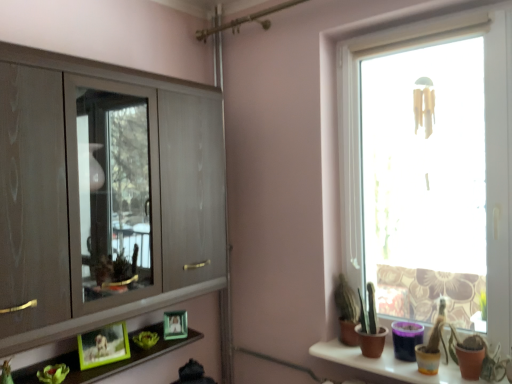
The width and height of the screenshot is (512, 384). Describe the element at coordinates (388, 364) in the screenshot. I see `terracotta clay pots at lower right` at that location.

Where is `matte wood cupboard at left`? This screenshot has height=384, width=512. matte wood cupboard at left is located at coordinates (103, 194).

What is the approximate width of green matte picture frame at lower center, the second picture frame from the left?

It is 2.56 inches.

The height and width of the screenshot is (384, 512). What do you see at coordinates (103, 346) in the screenshot? I see `green matte picture frame at lower left, which appears as the 1th picture frame when viewed from the front` at bounding box center [103, 346].

This screenshot has height=384, width=512. In order to click on terracotta clay pots at lower right in this screenshot , I will do `click(388, 364)`.

Which point is more distant from viewer, (352, 116) or (169, 315)?

The point (169, 315) is behind.

From the image's perspective, which one is positioned lower, transparent glass window at right or green matte picture frame at lower center, placed as the second picture frame when sorted from front to back?

green matte picture frame at lower center, placed as the second picture frame when sorted from front to back.

Considering the relative sizes of transparent glass window at right and green matte picture frame at lower center, placed as the second picture frame when sorted from front to back, in the image provided, is transparent glass window at right thinner than green matte picture frame at lower center, placed as the second picture frame when sorted from front to back,?

In fact, transparent glass window at right might be wider than green matte picture frame at lower center, placed as the second picture frame when sorted from front to back.

Where is `the 2nd picture frame below the transparent glass window at right (from the image's perspective)`? The image size is (512, 384). the 2nd picture frame below the transparent glass window at right (from the image's perspective) is located at coordinates (175, 325).

Can you confirm if terracotta clay pots at lower right is smaller than green matte plant at lower left?

Actually, terracotta clay pots at lower right might be larger than green matte plant at lower left.

From the image's perspective, is terracotta clay pots at lower right located above green matte plant at lower left?

Actually, terracotta clay pots at lower right appears below green matte plant at lower left in the image.

Is green matte plant at lower left surrounded by terracotta clay pots at lower right?

No, green matte plant at lower left is not a part of terracotta clay pots at lower right.

I want to click on plant located above the terracotta clay pots at lower right (from a real-world perspective), so click(53, 374).

Would you say transparent glass window at right contains matte wood cupboard at left?

No.

How different are the orientations of transparent glass window at right and matte wood cupboard at left in degrees?

The facing directions of transparent glass window at right and matte wood cupboard at left are 90.2 degrees apart.

From a real-world perspective, is transparent glass window at right on matte wood cupboard at left?

No, from a real-world perspective, transparent glass window at right is not on top of matte wood cupboard at left.

Considering the sizes of objects terracotta clay pots at lower right and green matte picture frame at lower center, which is the first picture frame in back-to-front order, in the image provided, who is thinner, terracotta clay pots at lower right or green matte picture frame at lower center, which is the first picture frame in back-to-front order,?

green matte picture frame at lower center, which is the first picture frame in back-to-front order, is thinner.

Relative to green matte picture frame at lower center, placed as the second picture frame when sorted from front to back, is terracotta clay pots at lower right in front or behind?

Clearly, terracotta clay pots at lower right is in front of green matte picture frame at lower center, placed as the second picture frame when sorted from front to back.

Is terracotta clay pots at lower right turned away from green matte picture frame at lower center, which is the first picture frame in back-to-front order?

No, green matte picture frame at lower center, which is the first picture frame in back-to-front order, is not at the back of terracotta clay pots at lower right.

Does terracotta clay pots at lower right touch green matte picture frame at lower center, the 1th picture frame positioned from the right?

No, terracotta clay pots at lower right is not next to green matte picture frame at lower center, the 1th picture frame positioned from the right.

From the image's perspective, is matte wood cupboard at left located beneath green matte picture frame at lower center, placed as the second picture frame when sorted from front to back?

No, from the image's perspective, matte wood cupboard at left is not beneath green matte picture frame at lower center, placed as the second picture frame when sorted from front to back.

Between matte wood cupboard at left and green matte picture frame at lower center, placed as the second picture frame when sorted from front to back, which one is positioned behind?

green matte picture frame at lower center, placed as the second picture frame when sorted from front to back, is more distant.

Do you think matte wood cupboard at left is within green matte picture frame at lower center, the second picture frame from the left, or outside of it?

matte wood cupboard at left exists outside the volume of green matte picture frame at lower center, the second picture frame from the left.

Would you consider matte wood cupboard at left to be distant from green matte picture frame at lower center, the 1th picture frame positioned from the right?

No, matte wood cupboard at left is not far from green matte picture frame at lower center, the 1th picture frame positioned from the right.

How much distance is there between green matte plant at lower left and green matte picture frame at lower center, the second picture frame from the left?

green matte plant at lower left is 53.84 centimeters from green matte picture frame at lower center, the second picture frame from the left.

Can you confirm if green matte plant at lower left is taller than green matte picture frame at lower center, the second picture frame from the left?

In fact, green matte plant at lower left may be shorter than green matte picture frame at lower center, the second picture frame from the left.

Is green matte plant at lower left facing towards green matte picture frame at lower center, which is the first picture frame in back-to-front order?

No, green matte plant at lower left is not facing towards green matte picture frame at lower center, which is the first picture frame in back-to-front order.

Can you confirm if green matte plant at lower left is thinner than green matte picture frame at lower center, placed as the second picture frame when sorted from front to back?

No.

Can you confirm if green matte picture frame at lower left, the 2th picture frame positioned from the right, is thinner than terracotta clay pots at lower right?

Yes, green matte picture frame at lower left, the 2th picture frame positioned from the right, is thinner than terracotta clay pots at lower right.

Considering the sizes of objects green matte picture frame at lower left, which appears as the 1th picture frame when viewed from the front, and terracotta clay pots at lower right in the image provided, who is shorter, green matte picture frame at lower left, which appears as the 1th picture frame when viewed from the front, or terracotta clay pots at lower right?

With less height is terracotta clay pots at lower right.

Consider the image. From the image's perspective, is green matte picture frame at lower left, the 2th picture frame positioned from the right, under terracotta clay pots at lower right?

Incorrect, from the image's perspective, green matte picture frame at lower left, the 2th picture frame positioned from the right, is higher than terracotta clay pots at lower right.

Would you say green matte picture frame at lower left, the second picture frame positioned from the back, contains terracotta clay pots at lower right?

Definitely not — terracotta clay pots at lower right is not inside green matte picture frame at lower left, the second picture frame positioned from the back.

Where is `the 2nd picture frame below when counting from the transparent glass window at right (from the image's perspective)`? The height and width of the screenshot is (384, 512). the 2nd picture frame below when counting from the transparent glass window at right (from the image's perspective) is located at coordinates (175, 325).

Find the location of a particular element. The image size is (512, 384). shelf that appears on the right of green matte plant at lower left is located at coordinates (388, 364).

From the picture: Which object lies further to the anchor point matte wood cupboard at left, terracotta clay pots at lower right or green matte plant at lower left?

terracotta clay pots at lower right is positioned further to the anchor matte wood cupboard at left.

Based on the photo, based on their spatial positions, is matte wood cupboard at left or green matte plant at lower left closer to transparent glass window at right?

Among the two, matte wood cupboard at left is located nearer to transparent glass window at right.

Considering their positions, is green matte picture frame at lower center, the 1th picture frame positioned from the right, positioned closer to green matte picture frame at lower left, the second picture frame positioned from the back, than matte wood cupboard at left?

Among the two, green matte picture frame at lower center, the 1th picture frame positioned from the right, is located nearer to green matte picture frame at lower left, the second picture frame positioned from the back.

Which object lies further to the anchor point terracotta clay pots at lower right, matte wood cupboard at left or transparent glass window at right?

Among the two, matte wood cupboard at left is located further to terracotta clay pots at lower right.

Considering their positions, is terracotta clay pots at lower right positioned further to green matte picture frame at lower left, the 2th picture frame positioned from the right, than matte wood cupboard at left?

The object further to green matte picture frame at lower left, the 2th picture frame positioned from the right, is terracotta clay pots at lower right.

Estimate the real-world distances between objects in this image. Which object is further from matte wood cupboard at left, terracotta clay pots at lower right or green matte picture frame at lower left, which is counted as the 1th picture frame, starting from the left?

The object further to matte wood cupboard at left is terracotta clay pots at lower right.

Estimate the real-world distances between objects in this image. Which object is closer to green matte picture frame at lower left, which is counted as the 1th picture frame, starting from the left, green matte picture frame at lower center, the second picture frame from the left, or green matte plant at lower left?

green matte plant at lower left is positioned closer to the anchor green matte picture frame at lower left, which is counted as the 1th picture frame, starting from the left.

When comparing their distances from green matte plant at lower left, does green matte picture frame at lower center, the second picture frame from the left, or transparent glass window at right seem further?

transparent glass window at right lies further to green matte plant at lower left than the other object.

Where is `cupboard between green matte plant at lower left and terracotta clay pots at lower right from left to right`? cupboard between green matte plant at lower left and terracotta clay pots at lower right from left to right is located at coordinates (103, 194).

Where is `shelf between matte wood cupboard at left and transparent glass window at right in the horizontal direction`? The image size is (512, 384). shelf between matte wood cupboard at left and transparent glass window at right in the horizontal direction is located at coordinates (388, 364).

The image size is (512, 384). In order to click on picture frame located between matte wood cupboard at left and terracotta clay pots at lower right in the left-right direction in this screenshot , I will do `click(175, 325)`.

You are a GUI agent. You are given a task and a screenshot of the screen. Output one action in this format:
    pyautogui.click(x=<x>, y=<y>)
    Task: Click on the cupboard located between green matte picture frame at lower left, which is counted as the 1th picture frame, starting from the left, and terracotta clay pots at lower right in the left-right direction
    The image size is (512, 384).
    Given the screenshot: What is the action you would take?
    pyautogui.click(x=103, y=194)